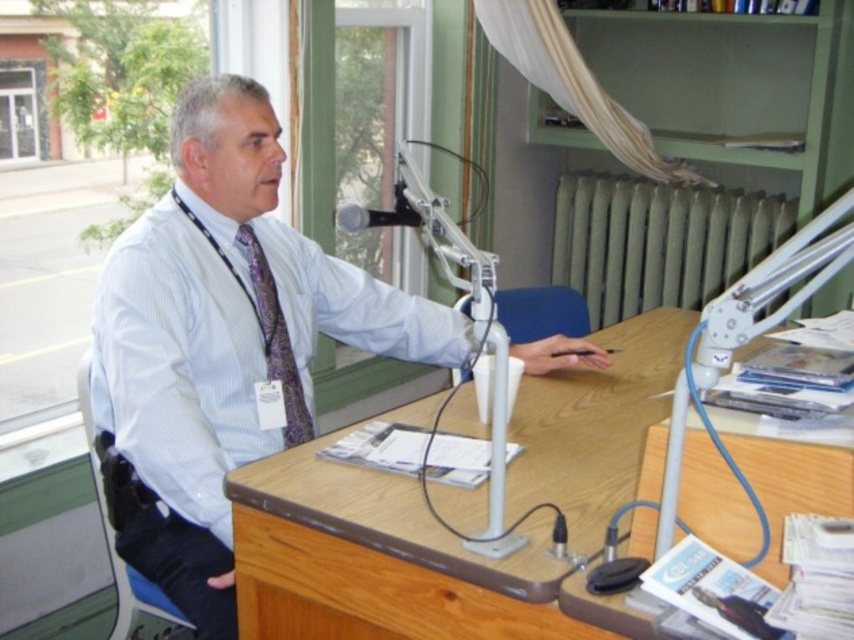
You are a technician adjusting the microphone stand in the studio. You notice two points marked on the desk for alignment. The points are labeled as point (364, 308) and point (132, 312). Which point is closer to the microphone stand that the man is using?

Point (364, 308) is further to the viewer than point (132, 312). Since the microphone stand is in front of the man, the closer point to the microphone would be point (132, 312) as it is nearer to the viewer, aligning with the microphone stand position.

Based on the photo, you are a visitor entering the studio and need to sit down quickly. Which object between the blue fabric chair at center and the black matte microphone at upper center can you sit on?

The blue fabric chair at center has a greater height compared to the black matte microphone at upper center, so you can sit on the blue fabric chair at center.